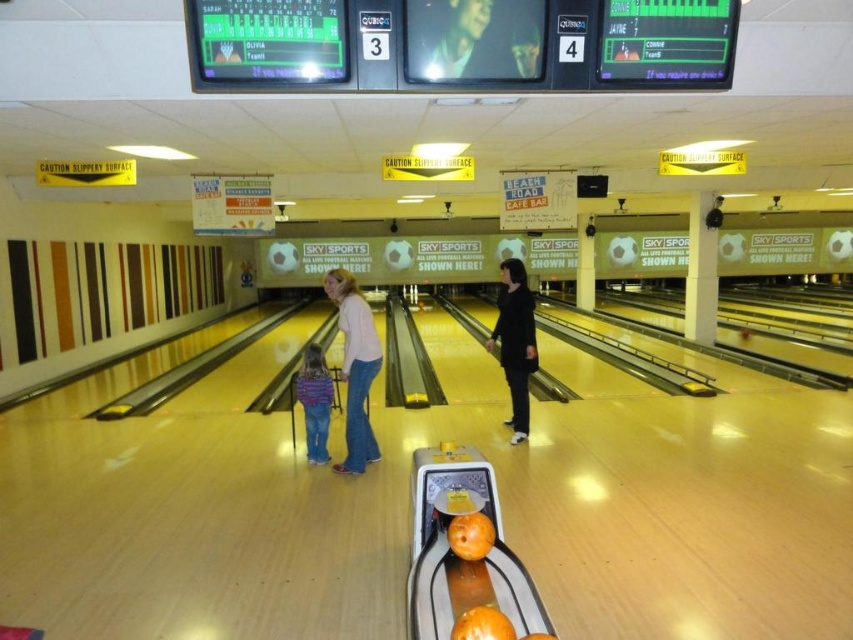
Does smooth skin face at upper center have a larger size compared to black matte jacket at center?

Actually, smooth skin face at upper center might be smaller than black matte jacket at center.

Can you confirm if smooth skin face at upper center is shorter than black matte jacket at center?

Yes, smooth skin face at upper center is shorter than black matte jacket at center.

Between point (463, 20) and point (509, 272), which one is positioned in front?

Point (463, 20) is in front.

At what (x,y) coordinates should I click in order to perform the action: click on smooth skin face at upper center. Please return your answer as a coordinate pair (x, y). Looking at the image, I should click on (483, 38).

Does point (428, 13) lie in front of point (341, 301)?

Yes, it is.

You are a GUI agent. You are given a task and a screenshot of the screen. Output one action in this format:
    pyautogui.click(x=<x>, y=<y>)
    Task: Click on the smooth skin face at upper center
    The image size is (853, 640).
    Given the screenshot: What is the action you would take?
    pyautogui.click(x=483, y=38)

Between point (527, 388) and point (314, 355), which one is positioned in front?

Point (314, 355) is more forward.

Is black matte jacket at center bigger than striped fabric shirt at center?

Yes.

Is point (514, 301) positioned before point (297, 387)?

No, (514, 301) is further to viewer.

The image size is (853, 640). Find the location of `black matte jacket at center`. black matte jacket at center is located at coordinates (515, 342).